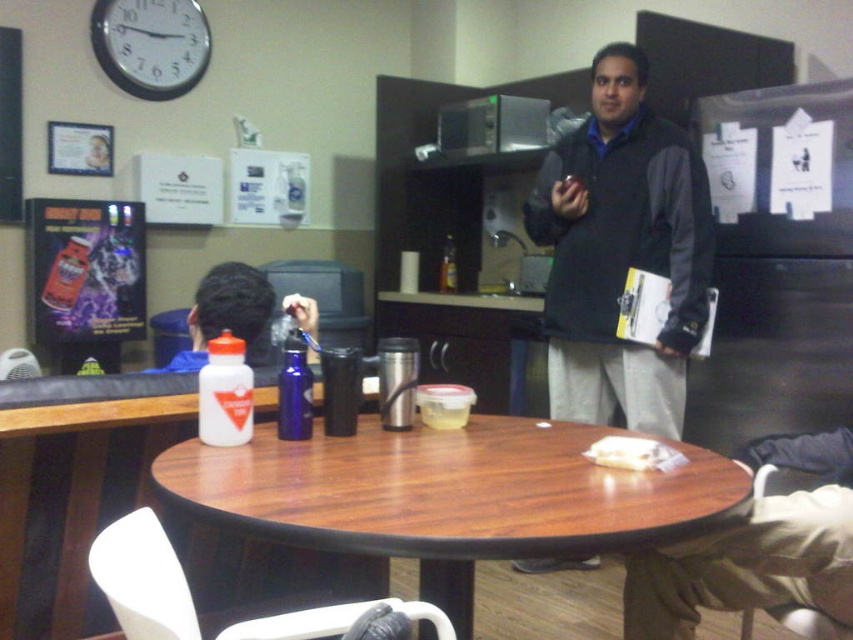
Question: Where is dark gray sweater at center located in relation to matte plastic water bottle at left in the image?

Choices:
 (A) right
 (B) left

Answer: (A)

Question: Does matte plastic water bottle at left appear over leather-like beige chair at lower right?

Choices:
 (A) yes
 (B) no

Answer: (A)

Question: Which of the following is the closest to the observer?

Choices:
 (A) matte plastic water bottle at left
 (B) white plastic chair at lower left
 (C) white matte sandwich at center

Answer: (B)

Question: Which object appears closest to the camera in this image?

Choices:
 (A) leather-like beige chair at lower right
 (B) white plastic chair at lower left
 (C) dark gray sweater at center
 (D) white matte sandwich at center

Answer: (B)

Question: Which object is positioned closest to the leather-like beige chair at lower right?

Choices:
 (A) white matte sandwich at center
 (B) wooden at center
 (C) white plastic clock at upper left
 (D) white plastic chair at lower left

Answer: (A)

Question: Does matte plastic water bottle at left have a lesser width compared to leather-like beige chair at lower right?

Choices:
 (A) no
 (B) yes

Answer: (A)